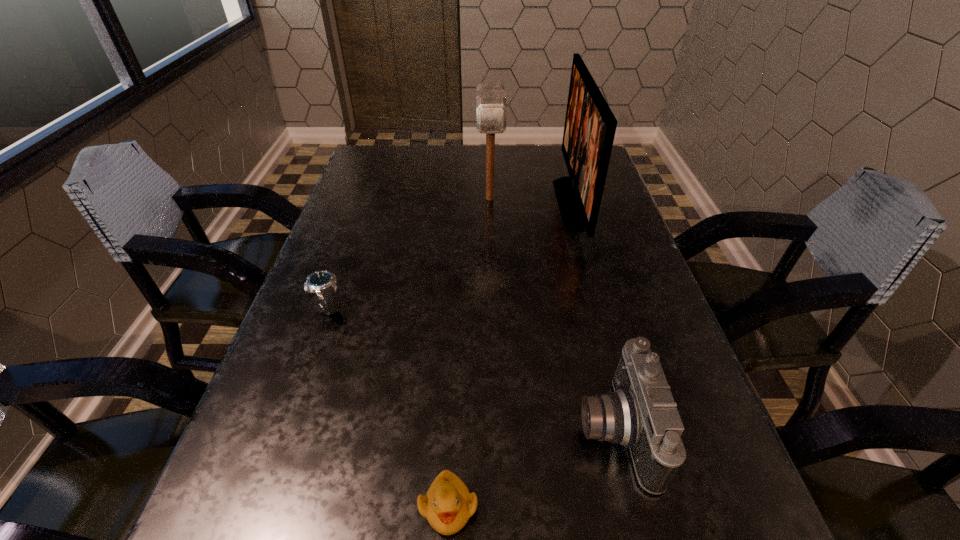
Locate an element on the screen. This screenshot has width=960, height=540. free spot between the monitor and the shortest object is located at coordinates (511, 355).

Where is `vacant area that lies between the mallet and the watch`? The image size is (960, 540). vacant area that lies between the mallet and the watch is located at coordinates (409, 253).

This screenshot has width=960, height=540. Find the location of `vacant space that is in between the mallet and the third tallest object`. vacant space that is in between the mallet and the third tallest object is located at coordinates (552, 314).

Choose which object is the fourth nearest neighbor to the third shortest object. Please provide its 2D coordinates. Your answer should be formatted as a tuple, i.e. [(x, y)], where the tuple contains the x and y coordinates of a point satisfying the conditions above.

[(491, 109)]

Identify which object is located as the fourth nearest to the monitor. Please provide its 2D coordinates. Your answer should be formatted as a tuple, i.e. [(x, y)], where the tuple contains the x and y coordinates of a point satisfying the conditions above.

[(448, 504)]